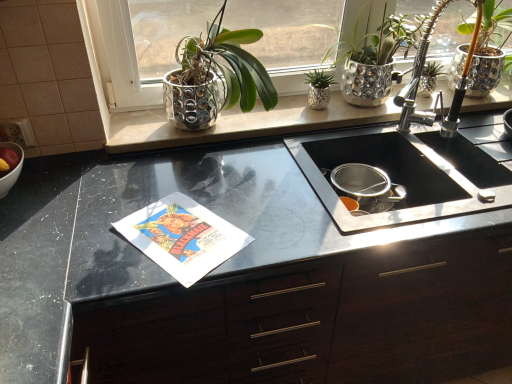
Where is `black matte cabinet at center`? The image size is (512, 384). black matte cabinet at center is located at coordinates (317, 321).

Locate an element on the screen. Image resolution: width=512 pixels, height=384 pixels. satin nickel faucet at upper right is located at coordinates (439, 94).

In order to click on green metallic pot at upper center, marked as the second houseplant in a right-to-left arrangement in this screenshot , I will do `click(319, 88)`.

This screenshot has height=384, width=512. I want to click on black matte cabinet at center, so click(x=317, y=321).

From the image's perspective, which is below, green metallic pot at upper center, marked as the second houseplant in a right-to-left arrangement, or shiny metallic pot at upper center, which is the 3th houseplant in right-to-left order?

From the image's view, green metallic pot at upper center, marked as the second houseplant in a right-to-left arrangement, is below.

Is green metallic pot at upper center, marked as the second houseplant in a right-to-left arrangement, turned away from shiny metallic pot at upper center, which is the 3th houseplant in right-to-left order?

No.

From a real-world perspective, is green metallic pot at upper center, marked as the second houseplant in a right-to-left arrangement, under shiny metallic pot at upper center, which is the 3th houseplant in right-to-left order?

Yes.

Does point (327, 98) come behind point (203, 71)?

That is True.

Is white glossy bowl at left a part of shiny metallic pot at upper center, positioned as the 1th houseplant in left-to-right order?

No, white glossy bowl at left is not inside shiny metallic pot at upper center, positioned as the 1th houseplant in left-to-right order.

Is shiny metallic pot at upper center, which is the 3th houseplant in right-to-left order, oriented away from white glossy bowl at left?

No.

From the image's perspective, which object appears higher, shiny metallic pot at upper center, positioned as the 1th houseplant in left-to-right order, or white glossy bowl at left?

shiny metallic pot at upper center, positioned as the 1th houseplant in left-to-right order, appears higher in the image.

Which of these two, shiny metallic pot at upper center, which is the 3th houseplant in right-to-left order, or white glossy bowl at left, is wider?

shiny metallic pot at upper center, which is the 3th houseplant in right-to-left order, is wider.

Considering the sizes of objects black matte cabinet at center and shiny metallic pot at upper center, positioned as the 1th houseplant in left-to-right order, in the image provided, who is wider, black matte cabinet at center or shiny metallic pot at upper center, positioned as the 1th houseplant in left-to-right order,?

black matte cabinet at center.

Would you consider black matte cabinet at center to be distant from shiny metallic pot at upper center, which is the 3th houseplant in right-to-left order?

No.

Visually, is black matte cabinet at center positioned to the left or to the right of shiny metallic pot at upper center, which is the 3th houseplant in right-to-left order?

From the image, it's evident that black matte cabinet at center is to the right of shiny metallic pot at upper center, which is the 3th houseplant in right-to-left order.

Is shiny metallic pot at upper center, which is the 3th houseplant in right-to-left order, at the back of black matte cabinet at center?

No.

Could you measure the distance between satin nickel faucet at upper right and green metallic pot at upper center, which is counted as the second houseplant, starting from the left?

satin nickel faucet at upper right is 13.80 inches away from green metallic pot at upper center, which is counted as the second houseplant, starting from the left.

Is satin nickel faucet at upper right aimed at green metallic pot at upper center, marked as the second houseplant in a right-to-left arrangement?

No, satin nickel faucet at upper right is not aimed at green metallic pot at upper center, marked as the second houseplant in a right-to-left arrangement.

This screenshot has height=384, width=512. Find the location of `tap in front of the green metallic pot at upper center, marked as the second houseplant in a right-to-left arrangement`. tap in front of the green metallic pot at upper center, marked as the second houseplant in a right-to-left arrangement is located at coordinates (439, 94).

Is green metallic pot at upper center, which is counted as the second houseplant, starting from the left, completely or partially inside satin nickel faucet at upper right?

That's incorrect, green metallic pot at upper center, which is counted as the second houseplant, starting from the left, is not inside satin nickel faucet at upper right.

Who is shorter, satin nickel faucet at upper right or white glossy bowl at left?

With less height is white glossy bowl at left.

From the image's perspective, between satin nickel faucet at upper right and white glossy bowl at left, who is located below?

white glossy bowl at left, from the image's perspective.

Is satin nickel faucet at upper right facing towards white glossy bowl at left?

No, satin nickel faucet at upper right does not turn towards white glossy bowl at left.

In terms of size, does satin nickel faucet at upper right appear bigger or smaller than white glossy bowl at left?

satin nickel faucet at upper right is bigger than white glossy bowl at left.

From a real-world perspective, is satin nickel faucet at upper right under black matte cabinet at center?

Actually, satin nickel faucet at upper right is physically above black matte cabinet at center in the real world.

Which is in front, satin nickel faucet at upper right or black matte cabinet at center?

Positioned in front is black matte cabinet at center.

Considering the sizes of objects satin nickel faucet at upper right and black matte cabinet at center in the image provided, who is shorter, satin nickel faucet at upper right or black matte cabinet at center?

satin nickel faucet at upper right is shorter.

Can you confirm if satin nickel faucet at upper right is thinner than black matte cabinet at center?

Yes, satin nickel faucet at upper right is thinner than black matte cabinet at center.

Is there a large distance between white glossy bowl at left and shiny metallic pot at upper right, which is the first houseplant in right-to-left order?

Absolutely, white glossy bowl at left is distant from shiny metallic pot at upper right, which is the first houseplant in right-to-left order.

Based on their positions, is white glossy bowl at left located to the left or right of shiny metallic pot at upper right, which ranks as the 3th houseplant in left-to-right order?

white glossy bowl at left is to the left of shiny metallic pot at upper right, which ranks as the 3th houseplant in left-to-right order.

Is white glossy bowl at left taller or shorter than shiny metallic pot at upper right, which ranks as the 3th houseplant in left-to-right order?

Considering their sizes, white glossy bowl at left has less height than shiny metallic pot at upper right, which ranks as the 3th houseplant in left-to-right order.

From a real-world perspective, is white glossy bowl at left beneath shiny metallic pot at upper right, which ranks as the 3th houseplant in left-to-right order?

Yes, from a real-world perspective, white glossy bowl at left is beneath shiny metallic pot at upper right, which ranks as the 3th houseplant in left-to-right order.

From a real-world perspective, count 2nd houseplants downward from the shiny metallic pot at upper center, which is the 3th houseplant in right-to-left order, and point to it. Please provide its 2D coordinates.

[(319, 88)]

From a real-world perspective, count 2nd houseplants upward from the white glossy bowl at left and point to it. Please provide its 2D coordinates.

[(215, 77)]

Based on their spatial positions, is shiny metallic pot at upper center, positioned as the 1th houseplant in left-to-right order, or black matte cabinet at center closer to green metallic pot at upper center, marked as the second houseplant in a right-to-left arrangement?

Based on the image, shiny metallic pot at upper center, positioned as the 1th houseplant in left-to-right order, appears to be nearer to green metallic pot at upper center, marked as the second houseplant in a right-to-left arrangement.

Estimate the real-world distances between objects in this image. Which object is further from shiny metallic pot at upper right, which ranks as the 3th houseplant in left-to-right order, white glossy bowl at left or shiny metallic pot at upper center, which is the 3th houseplant in right-to-left order?

white glossy bowl at left.

Based on their spatial positions, is white glossy bowl at left or shiny metallic pot at upper right, which is the first houseplant in right-to-left order, further from black matte cabinet at center?

white glossy bowl at left.

Estimate the real-world distances between objects in this image. Which object is closer to shiny metallic pot at upper right, which is the first houseplant in right-to-left order, green metallic pot at upper center, which is counted as the second houseplant, starting from the left, or shiny metallic pot at upper center, positioned as the 1th houseplant in left-to-right order?

green metallic pot at upper center, which is counted as the second houseplant, starting from the left, is positioned closer to the anchor shiny metallic pot at upper right, which is the first houseplant in right-to-left order.

Which object lies further to the anchor point white glossy bowl at left, black matte cabinet at center or shiny metallic pot at upper center, which is the 3th houseplant in right-to-left order?

Based on the image, black matte cabinet at center appears to be further to white glossy bowl at left.

Which object lies further to the anchor point satin nickel faucet at upper right, shiny metallic pot at upper center, positioned as the 1th houseplant in left-to-right order, or white glossy bowl at left?

white glossy bowl at left is further to satin nickel faucet at upper right.

Looking at the image, which one is located further to black matte cabinet at center, shiny metallic pot at upper center, positioned as the 1th houseplant in left-to-right order, or green metallic pot at upper center, which is counted as the second houseplant, starting from the left?

green metallic pot at upper center, which is counted as the second houseplant, starting from the left, lies further to black matte cabinet at center than the other object.

Estimate the real-world distances between objects in this image. Which object is closer to black matte cabinet at center, green metallic pot at upper center, which is counted as the second houseplant, starting from the left, or white glossy bowl at left?

green metallic pot at upper center, which is counted as the second houseplant, starting from the left, is positioned closer to the anchor black matte cabinet at center.

Locate an element on the screen. Image resolution: width=512 pixels, height=384 pixels. cabinetry between white glossy bowl at left and satin nickel faucet at upper right from left to right is located at coordinates (317, 321).

Locate an element on the screen. houseplant between white glossy bowl at left and green metallic pot at upper center, marked as the second houseplant in a right-to-left arrangement, from left to right is located at coordinates (215, 77).

Locate an element on the screen. The height and width of the screenshot is (384, 512). tap between shiny metallic pot at upper center, which is the 3th houseplant in right-to-left order, and black matte cabinet at center, in the vertical direction is located at coordinates (439, 94).

Image resolution: width=512 pixels, height=384 pixels. In order to click on houseplant located between shiny metallic pot at upper center, which is the 3th houseplant in right-to-left order, and shiny metallic pot at upper right, which is the first houseplant in right-to-left order, in the left-right direction in this screenshot , I will do `click(319, 88)`.